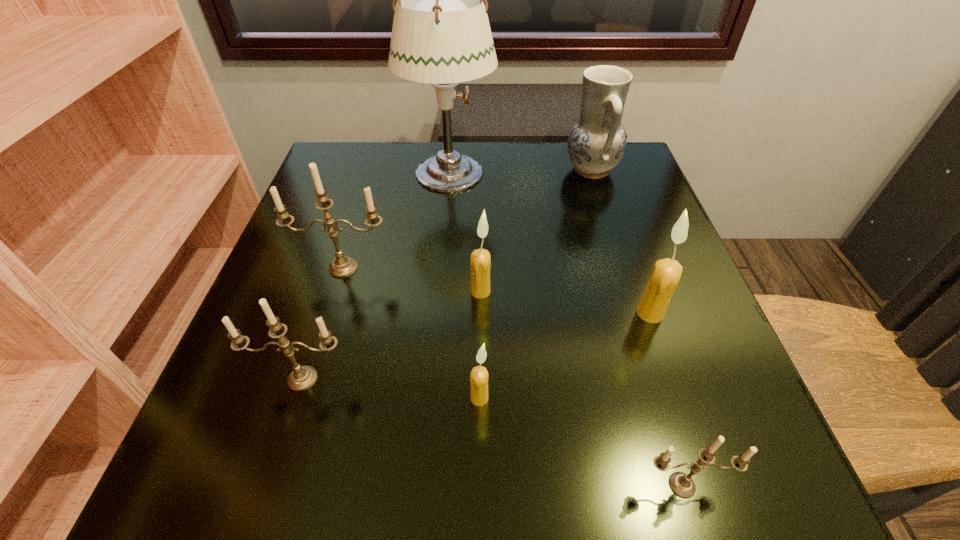
Locate an element on the screen. This screenshot has height=540, width=960. the nearest candle is located at coordinates (681, 484).

Locate an element on the screen. the smallest metallic candle is located at coordinates (681, 484).

Image resolution: width=960 pixels, height=540 pixels. In order to click on free location located on the lampshade of the tallest object in this screenshot , I will do `click(516, 174)`.

Where is `vacant region located 0.130m on the left of the blue pottery`? vacant region located 0.130m on the left of the blue pottery is located at coordinates (511, 170).

This screenshot has height=540, width=960. In order to click on free space located on the left of the rightmost cream candle in this screenshot , I will do `click(608, 313)`.

The height and width of the screenshot is (540, 960). Find the location of `free space located 0.110m on the front of the biggest metallic candle`. free space located 0.110m on the front of the biggest metallic candle is located at coordinates (325, 325).

The height and width of the screenshot is (540, 960). I want to click on vacant space located 0.060m on the left of the second biggest cream candle, so click(x=437, y=291).

Locate an element on the screen. Image resolution: width=960 pixels, height=540 pixels. free space located on the right of the second smallest metallic candle is located at coordinates (602, 379).

The height and width of the screenshot is (540, 960). Find the location of `free location located on the right of the smallest cream candle`. free location located on the right of the smallest cream candle is located at coordinates (597, 398).

The width and height of the screenshot is (960, 540). I want to click on vacant space located on the back of the nearest candle, so (647, 372).